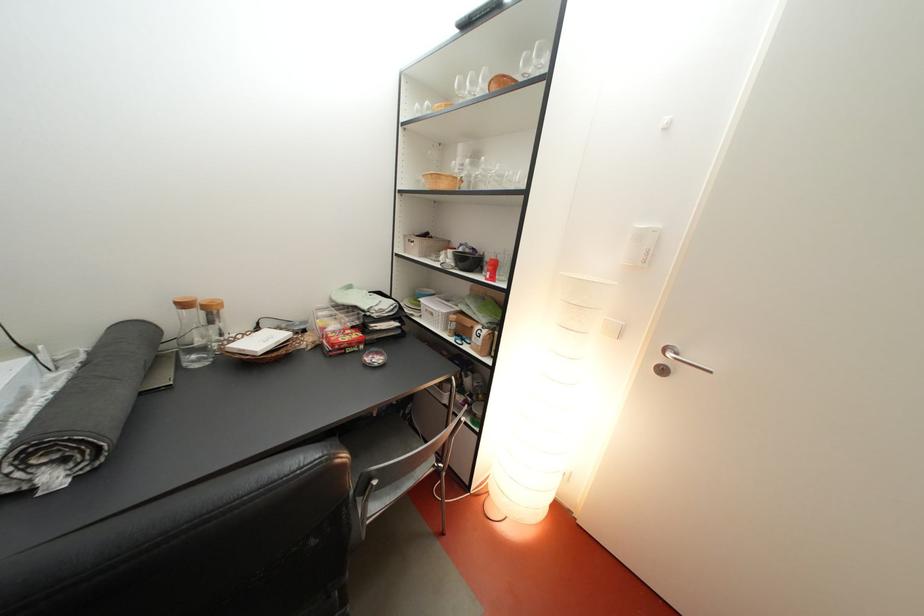
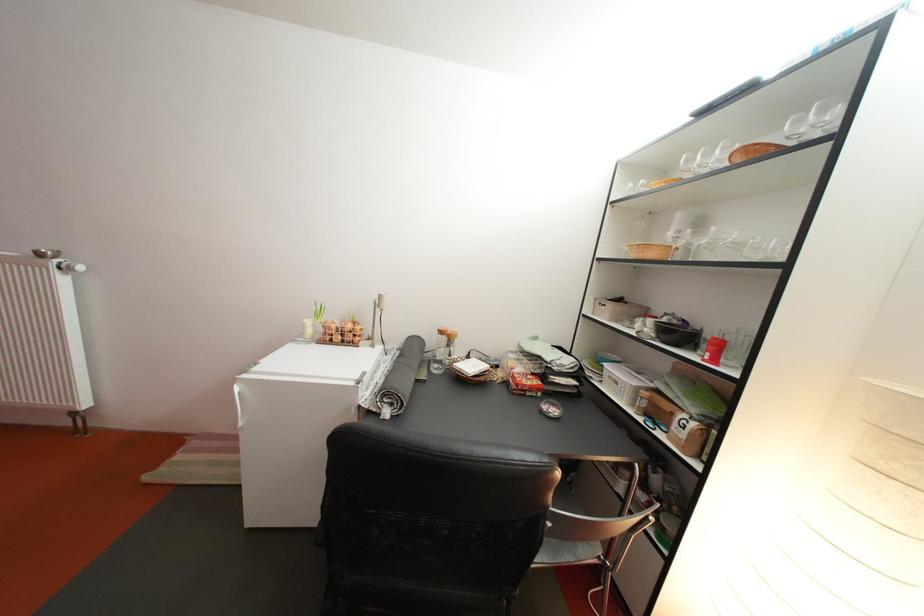
The point at (x=196, y=312) is marked in the first image. Where is the corresponding point in the second image?

(453, 339)